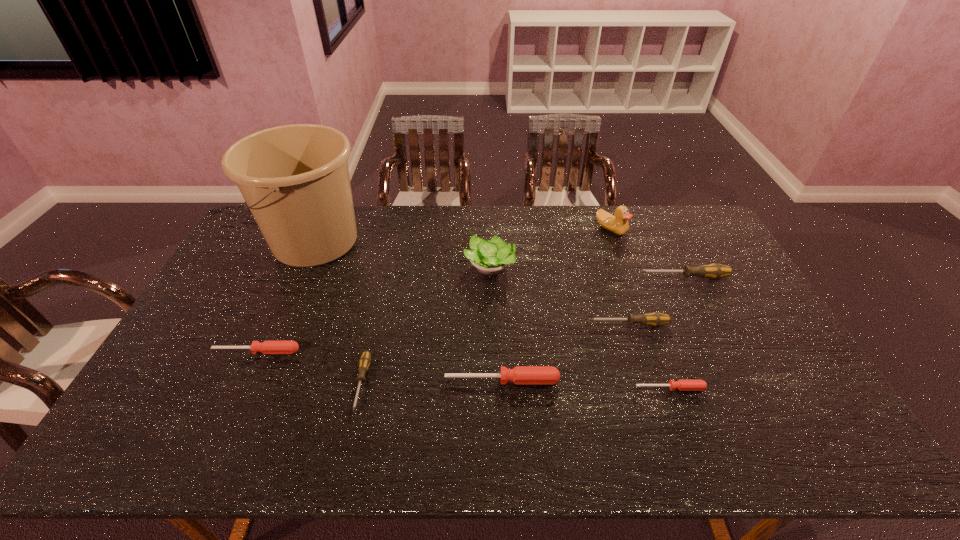
The width and height of the screenshot is (960, 540). Find the location of `the second red screwdriver from left to right`. the second red screwdriver from left to right is located at coordinates (521, 375).

Identify the location of the biggest red screwdriver. (521, 375).

Find the location of a particular element. This screenshot has height=540, width=960. the leftmost red screwdriver is located at coordinates (267, 347).

This screenshot has height=540, width=960. What are the coordinates of `the second biggest red screwdriver` in the screenshot? It's located at (267, 347).

You are a GUI agent. You are given a task and a screenshot of the screen. Output one action in this format:
    pyautogui.click(x=<x>, y=<y>)
    Task: Click on the second screwdriver from left to right
    The width and height of the screenshot is (960, 540).
    Given the screenshot: What is the action you would take?
    pyautogui.click(x=365, y=360)

Find the location of `the smallest gray screwdriver`. the smallest gray screwdriver is located at coordinates (365, 360).

In order to click on the shortest screwdriver in this screenshot , I will do `click(683, 385)`.

The image size is (960, 540). In order to click on the smallest red screwdriver in this screenshot , I will do `click(683, 385)`.

Locate an element on the screen. Image resolution: width=960 pixels, height=540 pixels. free location located 0.290m on the right of the beige bucket is located at coordinates (448, 241).

Identify the location of free space located 0.050m at the beak of the beige duck. Image resolution: width=960 pixels, height=540 pixels. (617, 247).